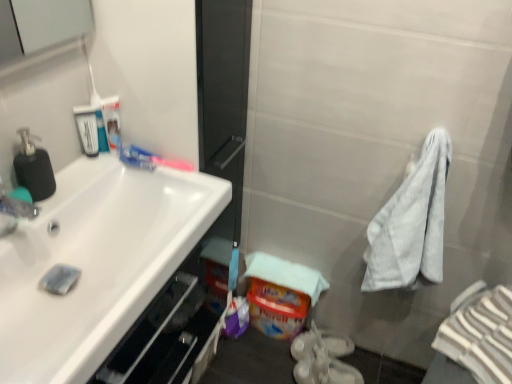
You are a GUI agent. You are given a task and a screenshot of the screen. Output one action in this format:
    pyautogui.click(x=<x>, y=<y>)
    Task: Click on the vacant area that is in front of white glossy toothpaste at upper left
    
    Given the screenshot: What is the action you would take?
    pyautogui.click(x=155, y=187)